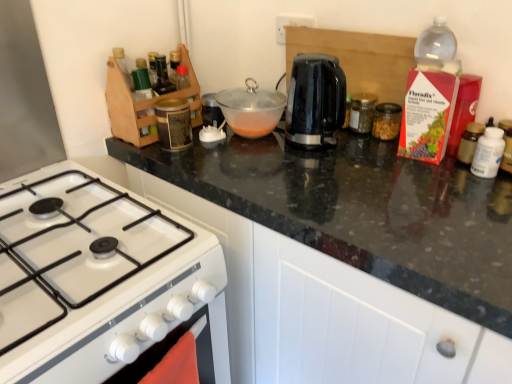
Question: Is black glossy electric kettle at center, which ranks as the 2th kitchen appliance in left-to-right order, positioned with its back to white glossy gas stove at lower left?

Choices:
 (A) no
 (B) yes

Answer: (A)

Question: Is black glossy electric kettle at center, the fourth kitchen appliance viewed from the right, outside white glossy gas stove at lower left?

Choices:
 (A) no
 (B) yes

Answer: (B)

Question: Is white glossy gas stove at lower left located within black glossy electric kettle at center, the fourth kitchen appliance viewed from the right?

Choices:
 (A) yes
 (B) no

Answer: (B)

Question: Is black glossy electric kettle at center, the fourth kitchen appliance viewed from the right, in front of white glossy gas stove at lower left?

Choices:
 (A) no
 (B) yes

Answer: (A)

Question: From the image's perspective, is black glossy electric kettle at center, which ranks as the 2th kitchen appliance in left-to-right order, above white glossy gas stove at lower left?

Choices:
 (A) no
 (B) yes

Answer: (B)

Question: Does black glossy electric kettle at center, which ranks as the 2th kitchen appliance in left-to-right order, lie behind white glossy gas stove at lower left?

Choices:
 (A) no
 (B) yes

Answer: (B)

Question: Is black granite countertop at upper center to the left of transparent glass bowl at center, positioned as the 1th kitchen appliance in left-to-right order, from the viewer's perspective?

Choices:
 (A) no
 (B) yes

Answer: (A)

Question: Is black granite countertop at upper center facing away from transparent glass bowl at center, arranged as the 5th kitchen appliance when viewed from the right?

Choices:
 (A) no
 (B) yes

Answer: (A)

Question: Can transparent glass bowl at center, arranged as the 5th kitchen appliance when viewed from the right, be found inside black granite countertop at upper center?

Choices:
 (A) no
 (B) yes

Answer: (A)

Question: Considering the relative sizes of black granite countertop at upper center and transparent glass bowl at center, positioned as the 1th kitchen appliance in left-to-right order, in the image provided, is black granite countertop at upper center smaller than transparent glass bowl at center, positioned as the 1th kitchen appliance in left-to-right order,?

Choices:
 (A) no
 (B) yes

Answer: (A)

Question: Is black granite countertop at upper center at the right side of transparent glass bowl at center, positioned as the 1th kitchen appliance in left-to-right order?

Choices:
 (A) yes
 (B) no

Answer: (A)

Question: Does black granite countertop at upper center have a lesser height compared to transparent glass bowl at center, positioned as the 1th kitchen appliance in left-to-right order?

Choices:
 (A) yes
 (B) no

Answer: (B)

Question: From a real-world perspective, is white glossy gas stove at lower left over black glossy electric kettle at center, which ranks as the 2th kitchen appliance in left-to-right order?

Choices:
 (A) yes
 (B) no

Answer: (B)